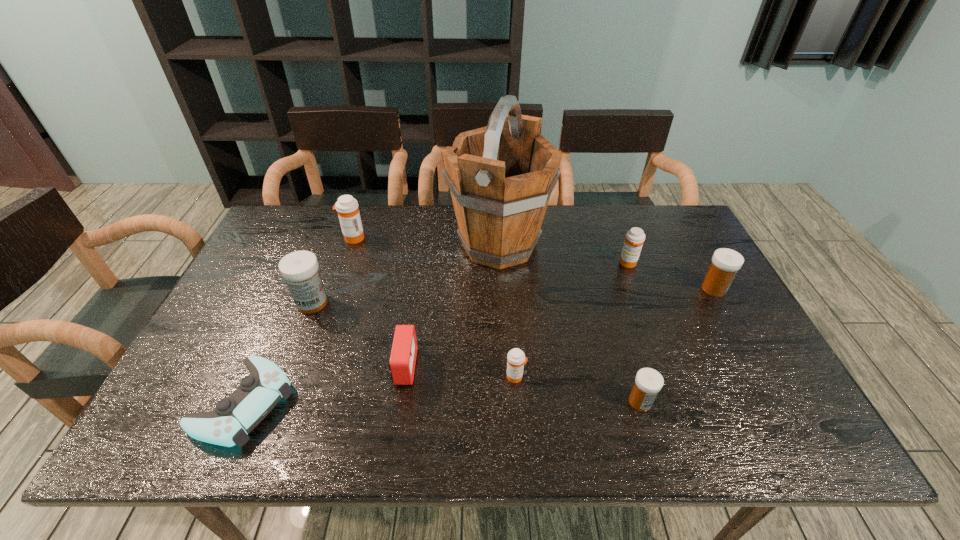
You are a GUI agent. You are given a task and a screenshot of the screen. Output one action in this format:
    pyautogui.click(x=<x>, y=<y>)
    Task: Click on the free spot located on the front-facing side of the alarm clock
    
    Given the screenshot: What is the action you would take?
    pyautogui.click(x=536, y=367)

Where is `vacant space positioned on the left of the nearest medicine`? vacant space positioned on the left of the nearest medicine is located at coordinates (521, 402).

What are the coordinates of `free location located 0.240m on the right of the smallest orange medicine` in the screenshot? It's located at (627, 376).

The width and height of the screenshot is (960, 540). Find the location of `vacant space located 0.230m on the right of the control`. vacant space located 0.230m on the right of the control is located at coordinates (391, 403).

Image resolution: width=960 pixels, height=540 pixels. I want to click on bucket that is at the far edge, so click(501, 176).

The height and width of the screenshot is (540, 960). What are the coordinates of `medicine located in the far edge section of the desktop` in the screenshot? It's located at (347, 207).

At what (x,y) coordinates should I click in order to perform the action: click on medicine that is positioned at the near edge. Please return your answer as a coordinate pair (x, y). Image resolution: width=960 pixels, height=540 pixels. Looking at the image, I should click on (648, 382).

You are a GUI agent. You are given a task and a screenshot of the screen. Output one action in this format:
    pyautogui.click(x=<x>, y=<y>)
    Task: Click on the control that is at the near edge
    The height and width of the screenshot is (540, 960).
    Given the screenshot: What is the action you would take?
    point(234,417)

Find the location of `object at the left edge`. object at the left edge is located at coordinates (234, 417).

The height and width of the screenshot is (540, 960). I want to click on object at the right edge, so click(x=726, y=262).